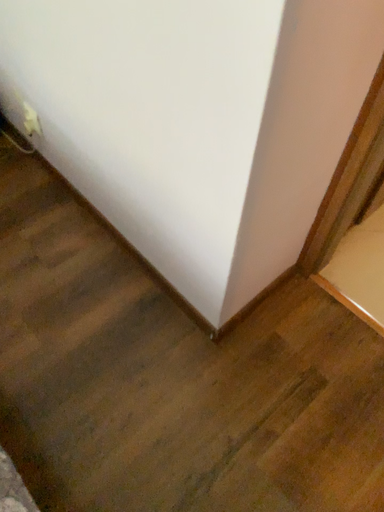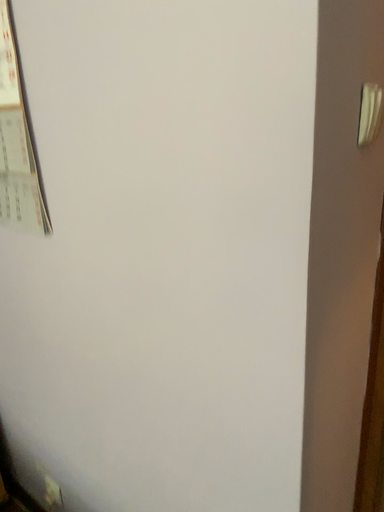
Question: How did the camera likely rotate when shooting the video?

Choices:
 (A) rotated downward
 (B) rotated upward

Answer: (B)